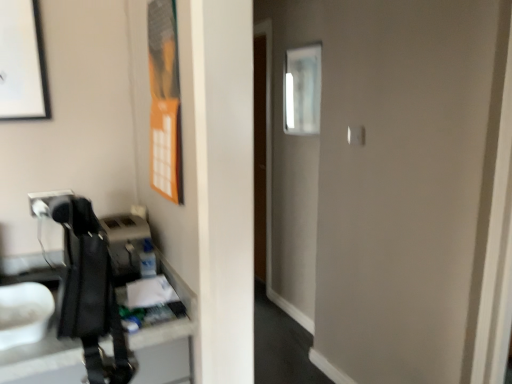
Question: Does clear glass mirror at upper center have a larger size compared to matte black picture frame at upper left?

Choices:
 (A) yes
 (B) no

Answer: (A)

Question: Is the depth of clear glass mirror at upper center greater than that of matte black picture frame at upper left?

Choices:
 (A) yes
 (B) no

Answer: (A)

Question: From the image's perspective, does clear glass mirror at upper center appear lower than matte black picture frame at upper left?

Choices:
 (A) yes
 (B) no

Answer: (B)

Question: Is clear glass mirror at upper center to the right of matte black picture frame at upper left from the viewer's perspective?

Choices:
 (A) no
 (B) yes

Answer: (B)

Question: Could you tell me if clear glass mirror at upper center is turned towards matte black picture frame at upper left?

Choices:
 (A) no
 (B) yes

Answer: (B)

Question: Is clear glass mirror at upper center in front of matte black picture frame at upper left?

Choices:
 (A) no
 (B) yes

Answer: (A)

Question: Can you confirm if matte black picture frame at upper left is taller than clear glass mirror at upper center?

Choices:
 (A) yes
 (B) no

Answer: (B)

Question: Is matte black picture frame at upper left thinner than clear glass mirror at upper center?

Choices:
 (A) yes
 (B) no

Answer: (A)

Question: Is matte black picture frame at upper left positioned behind clear glass mirror at upper center?

Choices:
 (A) yes
 (B) no

Answer: (B)

Question: Considering the relative sizes of matte black picture frame at upper left and clear glass mirror at upper center in the image provided, is matte black picture frame at upper left smaller than clear glass mirror at upper center?

Choices:
 (A) yes
 (B) no

Answer: (A)

Question: Is matte black picture frame at upper left positioned far away from clear glass mirror at upper center?

Choices:
 (A) yes
 (B) no

Answer: (A)

Question: Is the position of matte black picture frame at upper left less distant than that of clear glass mirror at upper center?

Choices:
 (A) no
 (B) yes

Answer: (B)

Question: From the image's perspective, relative to matte black picture frame at upper left, is clear glass mirror at upper center above or below?

Choices:
 (A) below
 (B) above

Answer: (B)